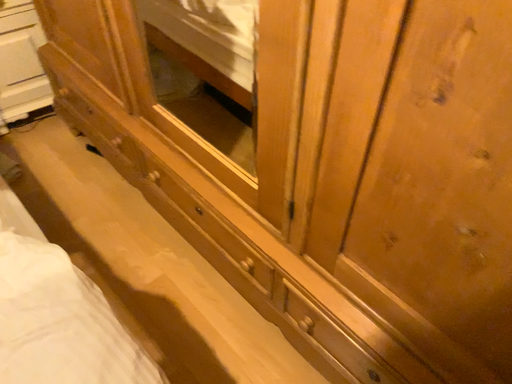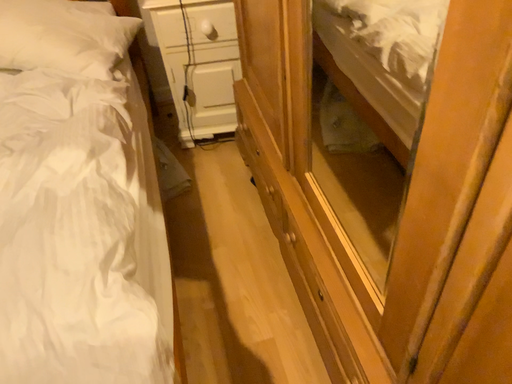
Question: Which way did the camera rotate in the video?

Choices:
 (A) rotated upward
 (B) rotated downward

Answer: (A)